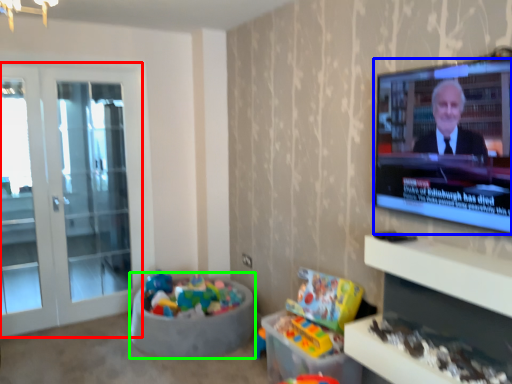
Question: Based on their relative distances, which object is nearer to screen door (highlighted by a red box)? Choose from television (highlighted by a blue box) and bean bag chair (highlighted by a green box).

Choices:
 (A) television
 (B) bean bag chair

Answer: (B)